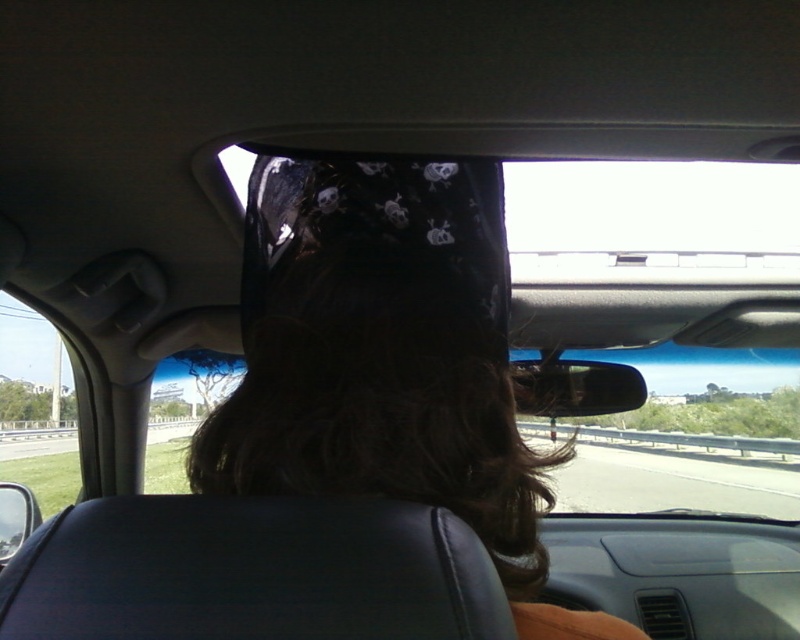
You are a passenger in the car and want to know the distance between the camera and the point at coordinates (293, 413). Can you determine if this distance is more than 28 inches?

The point at coordinates (293, 413) and the camera are 28.78 inches apart, so the distance is more than 28 inches.

You are a passenger in the car and want to locate the black leather headrest at center. According to the coordinates given, where exactly is it positioned?

The black leather headrest at center is positioned at coordinates point (252, 572).